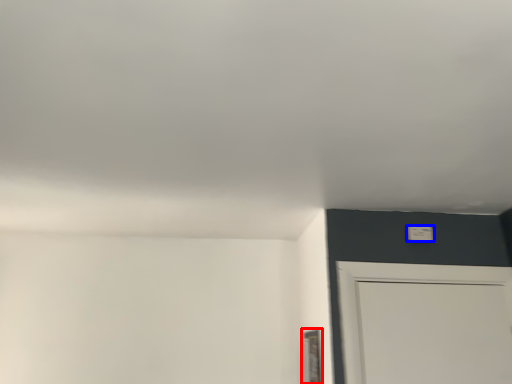
Question: Which point is closer to the camera, window (highlighted by a red box) or light switch (highlighted by a blue box)?

Choices:
 (A) window
 (B) light switch

Answer: (A)